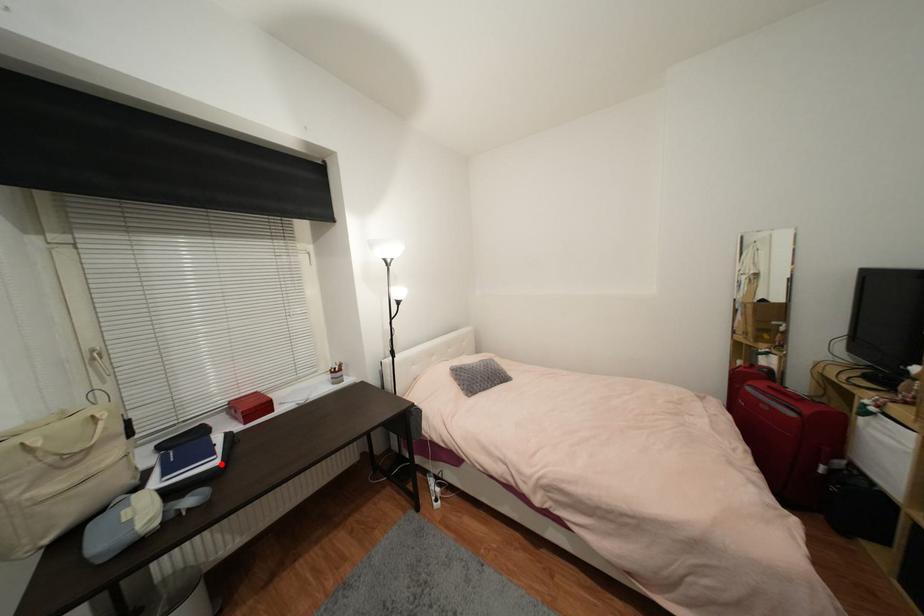
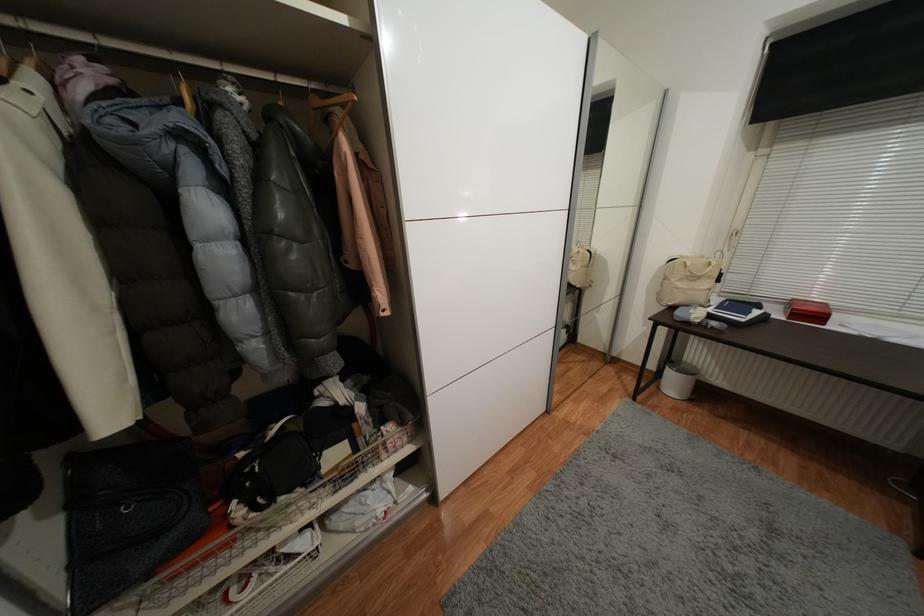
Where in the second image is the point corresponding to the highlighted location from the first image?

(747, 321)